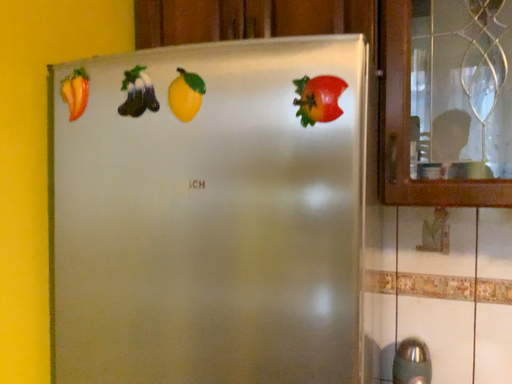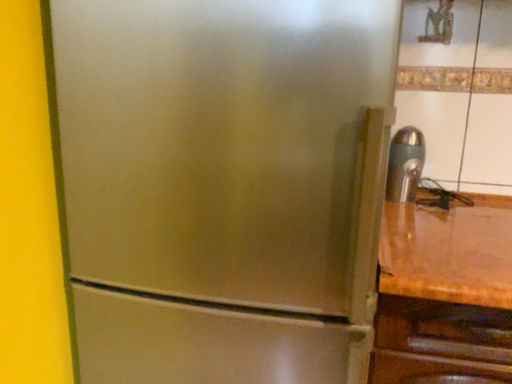
Question: How did the camera likely rotate when shooting the video?

Choices:
 (A) rotated left
 (B) rotated right

Answer: (B)